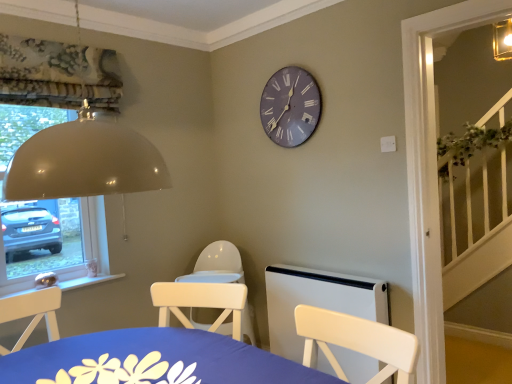
Question: Does blue fabric table at lower center come behind matte gray clock at upper center?

Choices:
 (A) yes
 (B) no

Answer: (B)

Question: Can you confirm if blue fabric table at lower center is thinner than matte gray clock at upper center?

Choices:
 (A) yes
 (B) no

Answer: (B)

Question: Considering the relative positions of blue fabric table at lower center and matte gray clock at upper center in the image provided, is blue fabric table at lower center to the right of matte gray clock at upper center from the viewer's perspective?

Choices:
 (A) yes
 (B) no

Answer: (B)

Question: Is blue fabric table at lower center wider than matte gray clock at upper center?

Choices:
 (A) no
 (B) yes

Answer: (B)

Question: From the image's perspective, is blue fabric table at lower center under matte gray clock at upper center?

Choices:
 (A) no
 (B) yes

Answer: (B)

Question: Is white plastic radiator at lower center to the left or to the right of blue fabric table at lower center in the image?

Choices:
 (A) left
 (B) right

Answer: (B)

Question: Does point (350, 352) appear closer or farther from the camera than point (112, 350)?

Choices:
 (A) farther
 (B) closer

Answer: (A)

Question: From the image's perspective, is white plastic radiator at lower center located above or below blue fabric table at lower center?

Choices:
 (A) below
 (B) above

Answer: (A)

Question: Is white plastic radiator at lower center wider or thinner than blue fabric table at lower center?

Choices:
 (A) thin
 (B) wide

Answer: (A)

Question: From their relative heights in the image, would you say blue fabric table at lower center is taller or shorter than matte gray clock at upper center?

Choices:
 (A) short
 (B) tall

Answer: (A)

Question: Considering their positions, is blue fabric table at lower center located in front of or behind matte gray clock at upper center?

Choices:
 (A) behind
 (B) front

Answer: (B)

Question: Considering the positions of blue fabric table at lower center and matte gray clock at upper center in the image, is blue fabric table at lower center wider or thinner than matte gray clock at upper center?

Choices:
 (A) wide
 (B) thin

Answer: (A)

Question: Considering the positions of point (90, 362) and point (290, 87), is point (90, 362) closer or farther from the camera than point (290, 87)?

Choices:
 (A) closer
 (B) farther

Answer: (A)

Question: Considering their positions, is white plastic radiator at lower center located in front of or behind matte gray clock at upper center?

Choices:
 (A) behind
 (B) front

Answer: (B)

Question: Visually, is white plastic radiator at lower center positioned to the left or to the right of matte gray clock at upper center?

Choices:
 (A) left
 (B) right

Answer: (B)